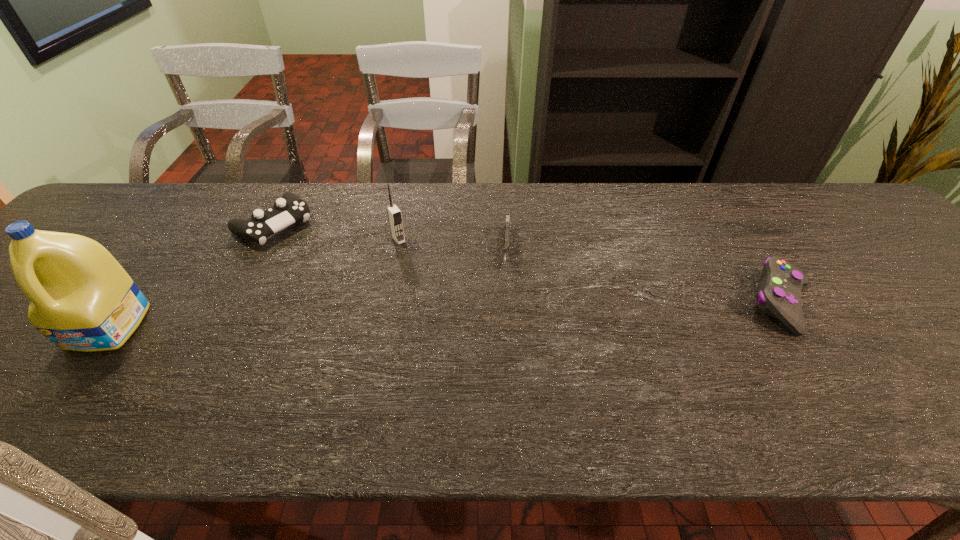
Locate an element on the screen. This screenshot has width=960, height=540. free spot on the desktop that is between the detergent and the rightmost object and is positioned aimed along the barrel of the gun is located at coordinates (503, 313).

Find the location of `vacant space on the desktop that is between the tallest object and the right control and is positioned on the front-facing side of the third object from left to right`. vacant space on the desktop that is between the tallest object and the right control and is positioned on the front-facing side of the third object from left to right is located at coordinates (458, 314).

Where is `vacant space on the desktop that is between the detergent and the right control and is positioned on the surface of the farther control`? The width and height of the screenshot is (960, 540). vacant space on the desktop that is between the detergent and the right control and is positioned on the surface of the farther control is located at coordinates (397, 316).